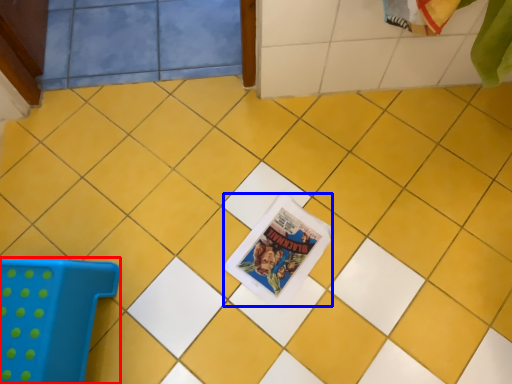
Question: Which of the following is the closest to the observer, furniture (highlighted by a red box) or comic book (highlighted by a blue box)?

Choices:
 (A) furniture
 (B) comic book

Answer: (A)